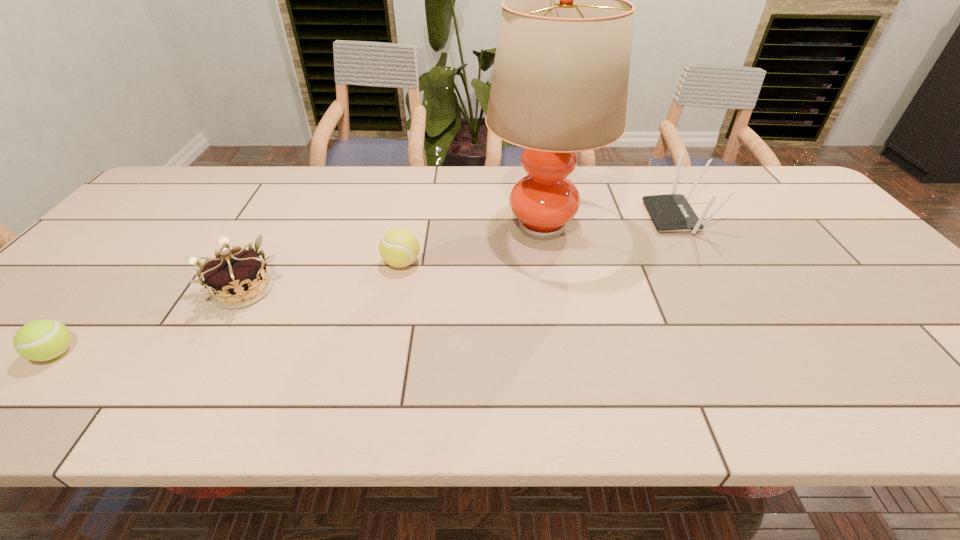
Where is `free space between the lamp and the farther tennis ball`? This screenshot has height=540, width=960. free space between the lamp and the farther tennis ball is located at coordinates (472, 245).

What are the coordinates of `empty space that is in between the rightmost object and the nearest object` in the screenshot? It's located at (367, 285).

Identify which object is the nearest to the rightmost object. Please provide its 2D coordinates. Your answer should be formatted as a tuple, i.e. [(x, y)], where the tuple contains the x and y coordinates of a point satisfying the conditions above.

[(559, 86)]

Point out which object is positioned as the fourth nearest to the right tennis ball. Please provide its 2D coordinates. Your answer should be formatted as a tuple, i.e. [(x, y)], where the tuple contains the x and y coordinates of a point satisfying the conditions above.

[(671, 212)]